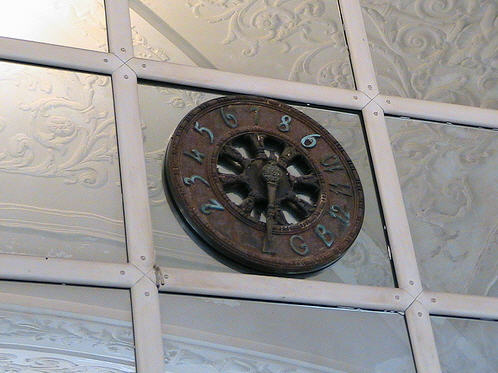
This screenshot has height=373, width=498. Identify the location of old brown clock. (250, 193).